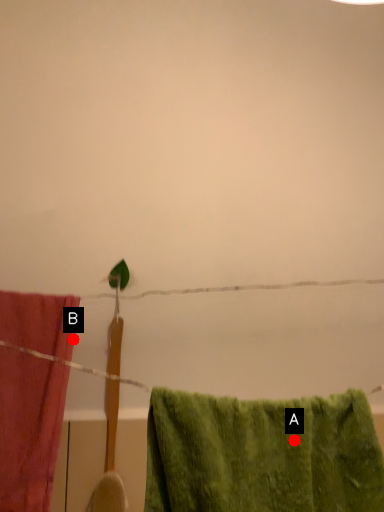
Question: Two points are circled on the image, labeled by A and B beside each circle. Which point appears closest to the camera in this image?

Choices:
 (A) A is closer
 (B) B is closer

Answer: (A)